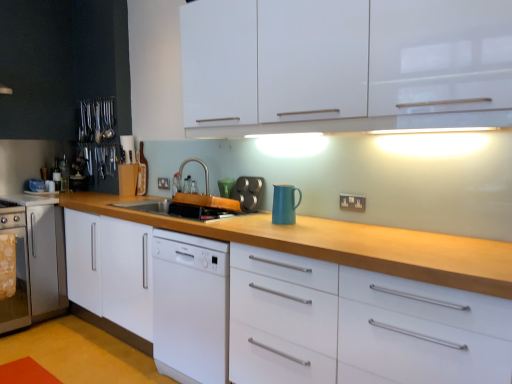
Question: Does point (167, 180) appear closer or farther from the camera than point (354, 200)?

Choices:
 (A) closer
 (B) farther

Answer: (B)

Question: From the image's perspective, is black plastic electric outlet at center, the second electric outlet positioned from the right, positioned above or below black plastic electrical outlet at center-right, arranged as the first electric outlet when ordered from the bottom?

Choices:
 (A) above
 (B) below

Answer: (A)

Question: Estimate the real-world distances between objects in this image. Which object is farther from the glossy ceramic pitcher at upper center?

Choices:
 (A) stainless steel oven at left, arranged as the 2th appliance when viewed from the front
 (B) black plastic electrical outlet at center-right, acting as the first electric outlet starting from the right
 (C) metallic silver muffin tin at center, acting as the second appliance starting from the left
 (D) black plastic electric outlet at center, positioned as the first electric outlet in back-to-front order
 (E) white glossy cabinet at upper center

Answer: (A)

Question: Which of these objects is positioned closest to the black plastic electric outlet at center, which is the 2th electric outlet from bottom to top?

Choices:
 (A) silver metallic faucet at center
 (B) white glossy drawer at center
 (C) black plastic electrical outlet at center-right, which is counted as the 1th electric outlet, starting from the front
 (D) glossy ceramic pitcher at upper center
 (E) stainless steel oven at left, the 2th appliance in the right-to-left sequence

Answer: (A)